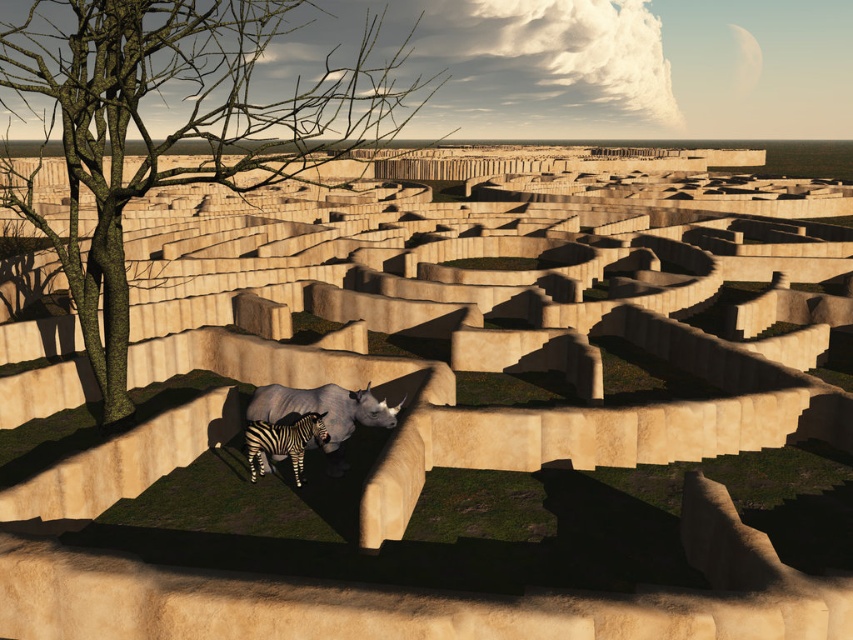
Consider the image. You are a bird flying above the maze and want to land on the green leafy tree at left. Can you see the gray matte rhino at center from your landing spot?

The green leafy tree at left is positioned over the gray matte rhino at center, so from the tree, you can see the rhino below.

You are a tour guide explaining the maze to visitors. You want to mention the distance between the gray matte rhino at center and the black and white striped zebra at center. What do you tell them?

The gray matte rhino at center and the black and white striped zebra at center are approximately 8.86 inches apart.

You are navigating through the maze in the image and need to determine which of the two points, point (x=334, y=410) or point (x=294, y=464), is closer to your current position. Based on the maze layout, which point is nearer to you?

Point (x=334, y=410) is further to the camera than point (x=294, y=464), so the point closer to your current position would be point (x=294, y=464).